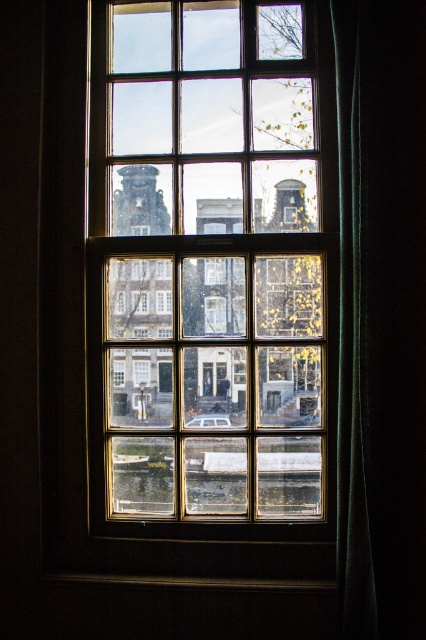
Does wooden frame at center have a greater height compared to black wood window sill at lower center?

Yes.

Between wooden frame at center and black wood window sill at lower center, which one has more height?

With more height is wooden frame at center.

Between point (131, 237) and point (235, 582), which one is positioned in front?

Positioned in front is point (235, 582).

Where is `wooden frame at center`? This screenshot has width=426, height=640. wooden frame at center is located at coordinates (213, 256).

Does green sheer curtain at right have a smaller size compared to black wood window sill at lower center?

No.

Between green sheer curtain at right and black wood window sill at lower center, which one has less height?

black wood window sill at lower center is shorter.

Locate an element on the screen. This screenshot has width=426, height=640. green sheer curtain at right is located at coordinates (351, 344).

You are a GUI agent. You are given a task and a screenshot of the screen. Output one action in this format:
    pyautogui.click(x=<x>, y=<y>)
    Task: Click on the green sheer curtain at right
    This screenshot has width=426, height=640.
    Given the screenshot: What is the action you would take?
    pyautogui.click(x=351, y=344)

Which of these two, wooden frame at center or green sheer curtain at right, stands taller?

green sheer curtain at right

Which is in front, point (319, 474) or point (362, 492)?

Point (362, 492)

Image resolution: width=426 pixels, height=640 pixels. What are the coordinates of `wooden frame at center` in the screenshot? It's located at (213, 256).